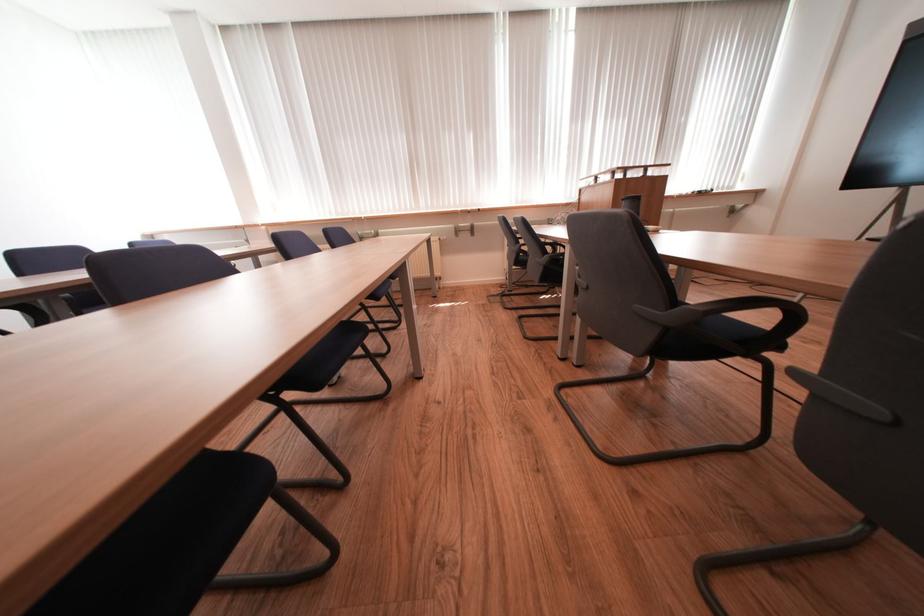
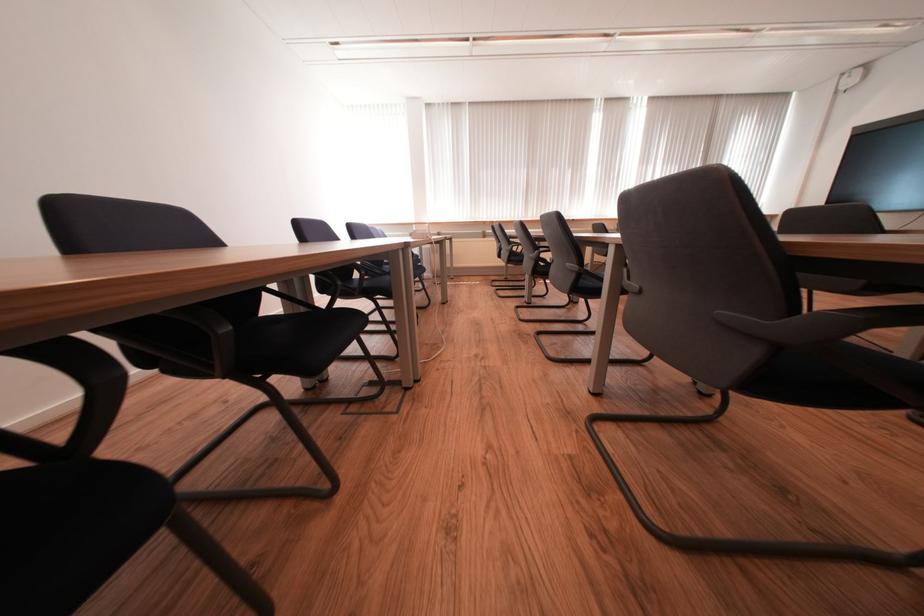
Which direction would the cameraman need to move to produce the second image?

The cameraman moved toward left, backward.